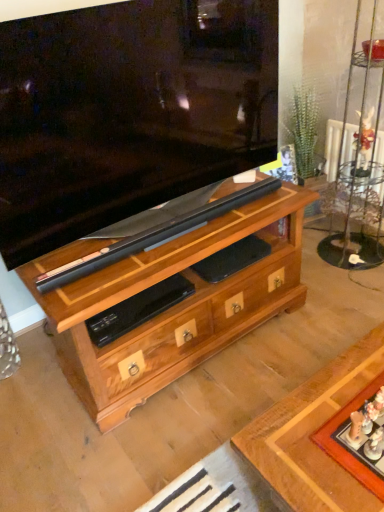
Image resolution: width=384 pixels, height=512 pixels. Describe the element at coordinates (351, 447) in the screenshot. I see `wooden board game at lower right` at that location.

Find the location of a particular element. This screenshot has width=384, height=512. wooden board game at lower right is located at coordinates (351, 447).

Image resolution: width=384 pixels, height=512 pixels. Identify the location of wooden chest of drawers at center. coord(171,307).

The image size is (384, 512). What do you see at coordinates (171, 307) in the screenshot? I see `wooden chest of drawers at center` at bounding box center [171, 307].

Find the location of a particular element. This screenshot has width=384, height=512. wooden board game at lower right is located at coordinates (351, 447).

Is wooden board game at lower right at the left side of wooden chest of drawers at center?

Incorrect, wooden board game at lower right is not on the left side of wooden chest of drawers at center.

Which object is further away from the camera, wooden board game at lower right or wooden chest of drawers at center?

wooden chest of drawers at center is more distant.

Is point (364, 393) closer or farther from the camera than point (215, 328)?

Point (364, 393) is closer to the camera than point (215, 328).

From the image's perspective, which is below, wooden board game at lower right or wooden chest of drawers at center?

wooden board game at lower right.

From a real-world perspective, which object stands above the other?

wooden board game at lower right is physically above.

Does wooden board game at lower right have a lesser width compared to wooden chest of drawers at center?

Correct, the width of wooden board game at lower right is less than that of wooden chest of drawers at center.

Considering the relative sizes of wooden board game at lower right and wooden chest of drawers at center in the image provided, is wooden board game at lower right taller than wooden chest of drawers at center?

No.

Is wooden board game at lower right bigger or smaller than wooden chest of drawers at center?

Clearly, wooden board game at lower right is smaller in size than wooden chest of drawers at center.

Is wooden board game at lower right not within wooden chest of drawers at center?

Absolutely, wooden board game at lower right is external to wooden chest of drawers at center.

Based on the photo, is wooden board game at lower right in contact with wooden chest of drawers at center?

No, wooden board game at lower right is not with wooden chest of drawers at center.

Could you tell me if wooden board game at lower right is turned towards wooden chest of drawers at center?

No, wooden board game at lower right is not facing towards wooden chest of drawers at center.

What's the angular difference between wooden board game at lower right and wooden chest of drawers at center's facing directions?

180 degrees.

Where is `chest of drawers behind the wooden board game at lower right`? chest of drawers behind the wooden board game at lower right is located at coordinates (171, 307).

Visually, is wooden chest of drawers at center positioned to the left or to the right of wooden board game at lower right?

From the image, it's evident that wooden chest of drawers at center is to the left of wooden board game at lower right.

Consider the image. Is wooden chest of drawers at center positioned before wooden board game at lower right?

No, wooden chest of drawers at center is further to the viewer.

Between point (53, 335) and point (373, 481), which one is positioned behind?

Point (53, 335)

From the image's perspective, is wooden chest of drawers at center below wooden board game at lower right?

No, from the image's perspective, wooden chest of drawers at center is not beneath wooden board game at lower right.

From a real-world perspective, is wooden chest of drawers at center over wooden board game at lower right?

Actually, wooden chest of drawers at center is physically below wooden board game at lower right in the real world.

Consider the image. Is wooden chest of drawers at center wider or thinner than wooden board game at lower right?

wooden chest of drawers at center is wider than wooden board game at lower right.

Is wooden chest of drawers at center taller or shorter than wooden board game at lower right?

wooden chest of drawers at center is taller than wooden board game at lower right.

Which of these two, wooden chest of drawers at center or wooden board game at lower right, is bigger?

wooden chest of drawers at center.

Is wooden chest of drawers at center situated inside wooden board game at lower right or outside?

wooden chest of drawers at center cannot be found inside wooden board game at lower right.

Is wooden chest of drawers at center not close to wooden board game at lower right?

wooden chest of drawers at center is actually quite close to wooden board game at lower right.

Does wooden chest of drawers at center turn towards wooden board game at lower right?

No, wooden chest of drawers at center is not aimed at wooden board game at lower right.

Measure the distance from wooden chest of drawers at center to wooden board game at lower right.

31.51 inches.

The height and width of the screenshot is (512, 384). I want to click on the chest of drawers lying above the wooden board game at lower right (from the image's perspective), so click(171, 307).

Locate an element on the screen. The height and width of the screenshot is (512, 384). chest of drawers behind the wooden board game at lower right is located at coordinates (171, 307).

Where is `chest of drawers above the wooden board game at lower right (from the image's perspective)`? This screenshot has height=512, width=384. chest of drawers above the wooden board game at lower right (from the image's perspective) is located at coordinates (171, 307).